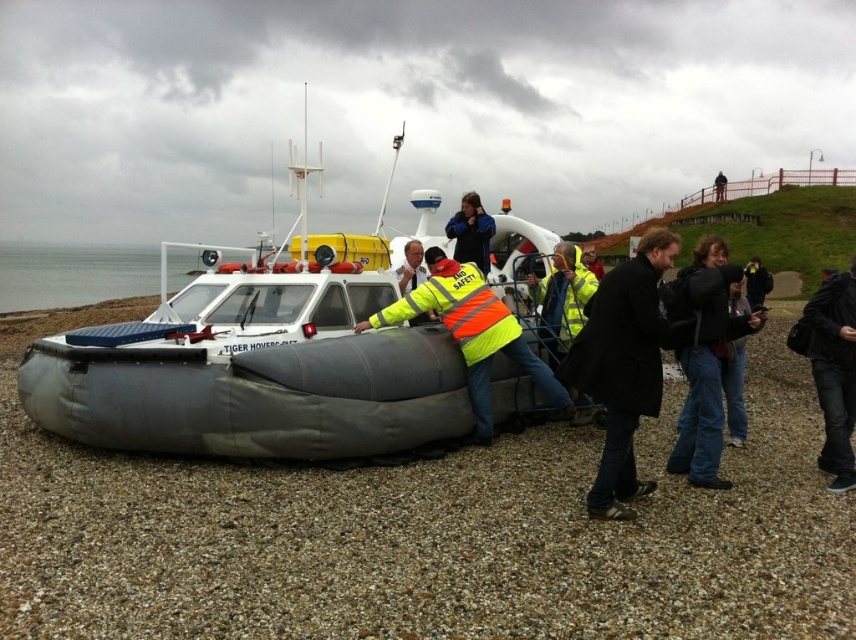
Question: In this image, where is gray rubber hovercraft at center located relative to black matte coat at center?

Choices:
 (A) left
 (B) right

Answer: (A)

Question: Which point is farther from the camera taking this photo?

Choices:
 (A) (236, 285)
 (B) (648, 484)
 (C) (807, 310)

Answer: (A)

Question: Is black matte coat at center thinner than high-visibility fabric safety vest at center?

Choices:
 (A) no
 (B) yes

Answer: (B)

Question: Among these objects, which one is nearest to the camera?

Choices:
 (A) gray rubber hovercraft at center
 (B) high-visibility fabric safety vest at center
 (C) black matte coat at center
 (D) black leather jacket at lower right

Answer: (C)

Question: Is black matte coat at center wider than high-visibility fabric safety vest at center?

Choices:
 (A) yes
 (B) no

Answer: (B)

Question: Estimate the real-world distances between objects in this image. Which object is farther from the gray rubber hovercraft at center?

Choices:
 (A) black leather jacket at lower right
 (B) black matte coat at center

Answer: (A)